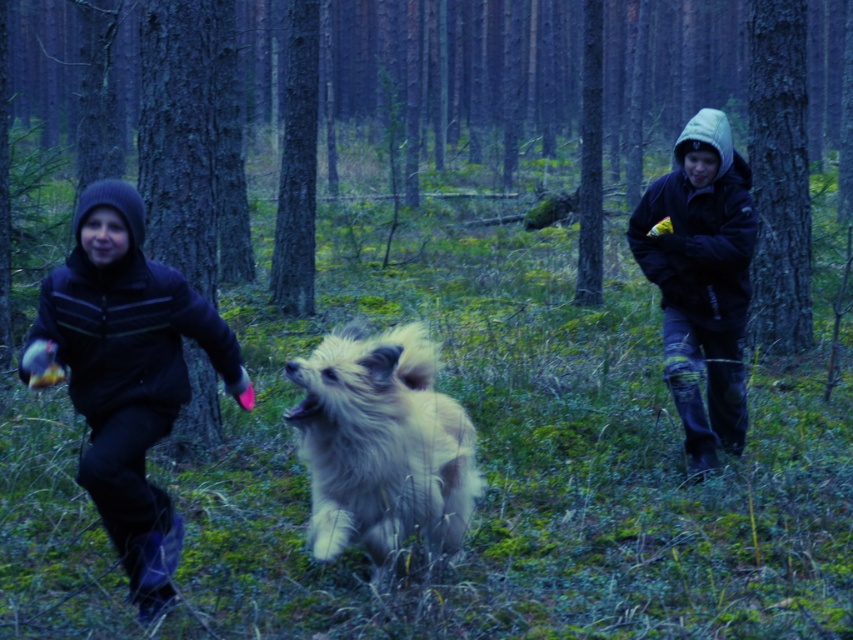
Question: Does fluffy white dog at center have a lesser width compared to dark blue hooded jacket at right?

Choices:
 (A) no
 (B) yes

Answer: (A)

Question: Which object appears farthest from the camera in this image?

Choices:
 (A) fluffy white dog at center
 (B) black fleece jacket at left
 (C) dark blue hooded jacket at right

Answer: (C)

Question: Can you confirm if black fleece jacket at left is positioned to the left of fluffy white dog at center?

Choices:
 (A) yes
 (B) no

Answer: (A)

Question: Does fluffy white dog at center lie in front of dark blue hooded jacket at right?

Choices:
 (A) no
 (B) yes

Answer: (B)

Question: Among these points, which one is nearest to the camera?

Choices:
 (A) (151, 339)
 (B) (724, 268)

Answer: (A)

Question: Which object is farther from the camera taking this photo?

Choices:
 (A) dark blue hooded jacket at right
 (B) fluffy white dog at center
 (C) black fleece jacket at left

Answer: (A)